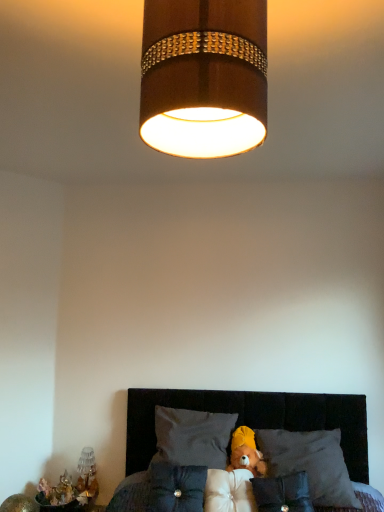
Question: From the image's perspective, is velvet dark gray bed at center located above or below fluffy brown teddy bear at center?

Choices:
 (A) above
 (B) below

Answer: (B)

Question: Is velvet dark gray bed at center situated inside fluffy brown teddy bear at center or outside?

Choices:
 (A) inside
 (B) outside

Answer: (B)

Question: Which is nearer to the velvety gray pillow at center, the 5th pillow viewed from the right?

Choices:
 (A) white soft pillow at center, positioned as the third pillow in left-to-right order
 (B) velvet dark gray pillow at lower center, the 4th pillow positioned from the left
 (C) wooden lampshade at upper center
 (D) dark gray fabric pillow at center, arranged as the first pillow when viewed from the right
 (E) translucent glass vase at lower left

Answer: (A)

Question: Estimate the real-world distances between objects in this image. Which object is farther from the translucent glass vase at lower left?

Choices:
 (A) gray fabric pillow at center, the fourth pillow positioned from the right
 (B) fluffy brown teddy bear at center
 (C) velvet dark gray bed at center
 (D) velvety gray pillow at center, placed as the 1th pillow when sorted from left to right
 (E) velvet dark gray pillow at lower center, the 4th pillow positioned from the left

Answer: (E)